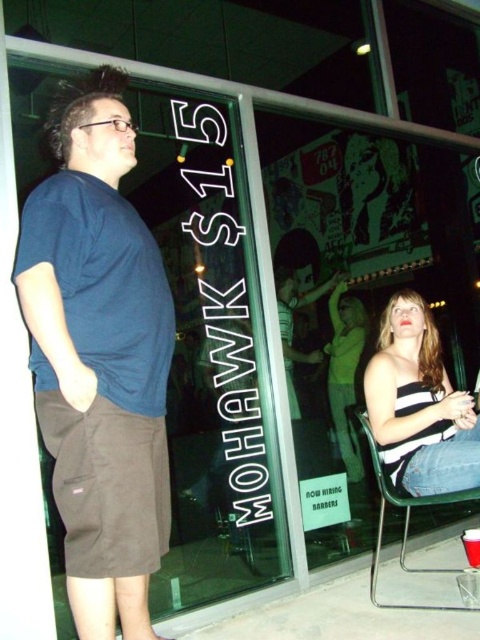
Question: Which of these objects is positioned farthest from the dark blue t-shirt at left?

Choices:
 (A) metallic silver chair at lower right
 (B) green fabric dress at lower right

Answer: (B)

Question: Is dark blue t-shirt at left to the right of metallic silver chair at lower right from the viewer's perspective?

Choices:
 (A) no
 (B) yes

Answer: (A)

Question: Does dark blue t-shirt at left appear on the left side of green fabric dress at lower right?

Choices:
 (A) yes
 (B) no

Answer: (A)

Question: Which object is positioned closest to the striped fabric top at lower right?

Choices:
 (A) metallic silver chair at lower right
 (B) dark blue t-shirt at left

Answer: (A)

Question: Does striped fabric top at lower right lie behind green fabric dress at lower right?

Choices:
 (A) no
 (B) yes

Answer: (A)

Question: Which is farther from the green fabric dress at lower right?

Choices:
 (A) metallic silver chair at lower right
 (B) dark blue t-shirt at left

Answer: (B)